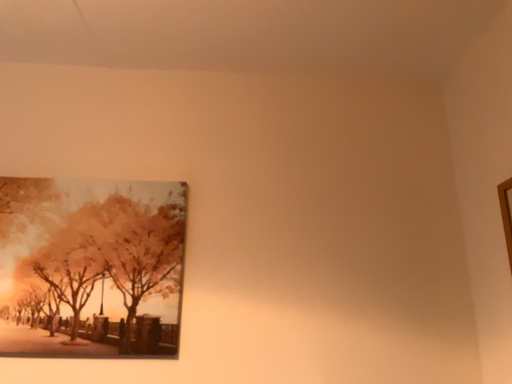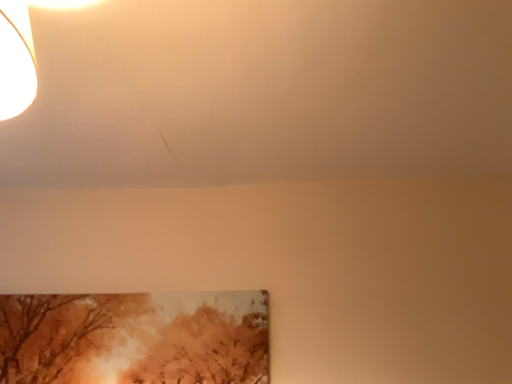
Question: How did the camera likely rotate when shooting the video?

Choices:
 (A) rotated right
 (B) rotated left

Answer: (B)